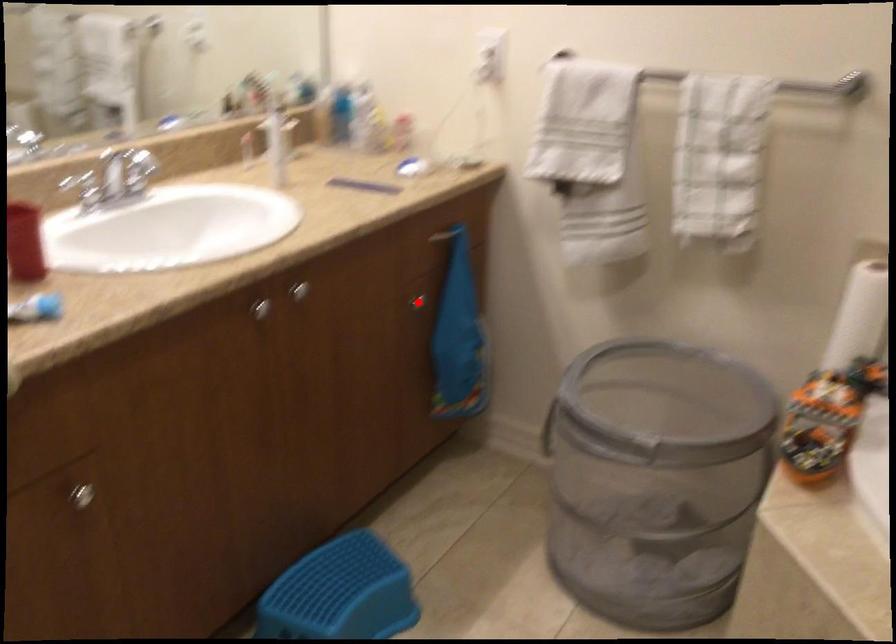
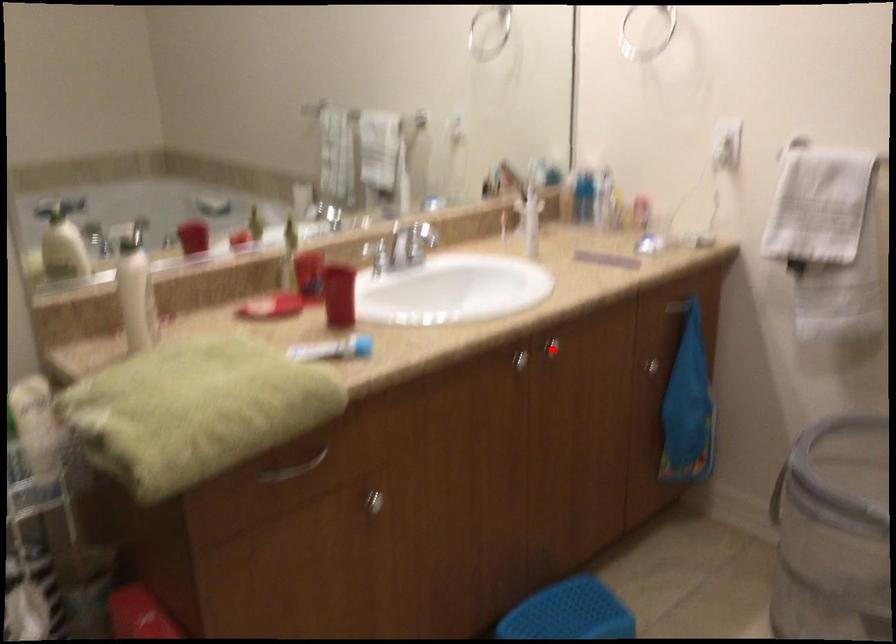
I am providing you with two images of the same scene from different viewpoints. A red point is marked on the first image and another point is marked on the second image. Are the points marked in image1 and image2 representing the same 3D position?

No